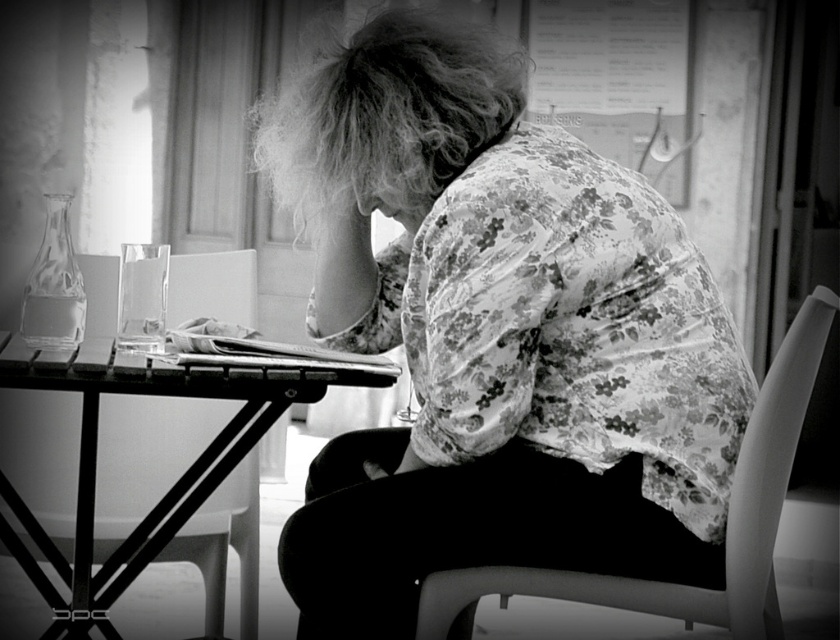
Question: Is metallic table at center smaller than smooth plastic chair at lower right?

Choices:
 (A) yes
 (B) no

Answer: (B)

Question: Which point appears closest to the camera in this image?

Choices:
 (A) (168, 536)
 (B) (371, 113)

Answer: (B)

Question: Which point is farther to the camera?

Choices:
 (A) smooth plastic chair at lower right
 (B) floral fabric shirt at center
 (C) smooth skin hand at center

Answer: (C)

Question: Is the position of floral fabric shirt at center more distant than that of smooth plastic chair at lower right?

Choices:
 (A) yes
 (B) no

Answer: (A)

Question: Which of these objects is positioned farthest from the metallic table at center?

Choices:
 (A) smooth plastic chair at lower right
 (B) smooth skin hand at center

Answer: (A)

Question: Can you confirm if metallic table at center is positioned to the left of smooth skin hand at center?

Choices:
 (A) yes
 (B) no

Answer: (A)